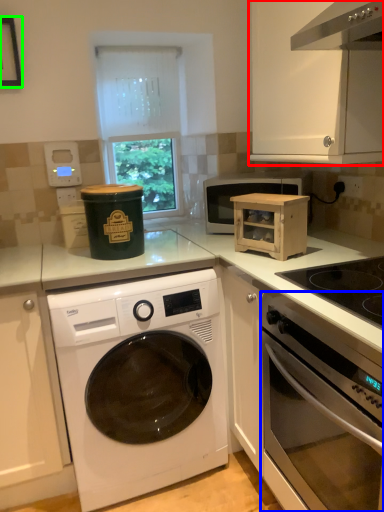
Question: Considering the real-world distances, which object is farthest from cabinetry (highlighted by a red box)? oven (highlighted by a blue box) or picture frame (highlighted by a green box)?

Choices:
 (A) oven
 (B) picture frame

Answer: (B)